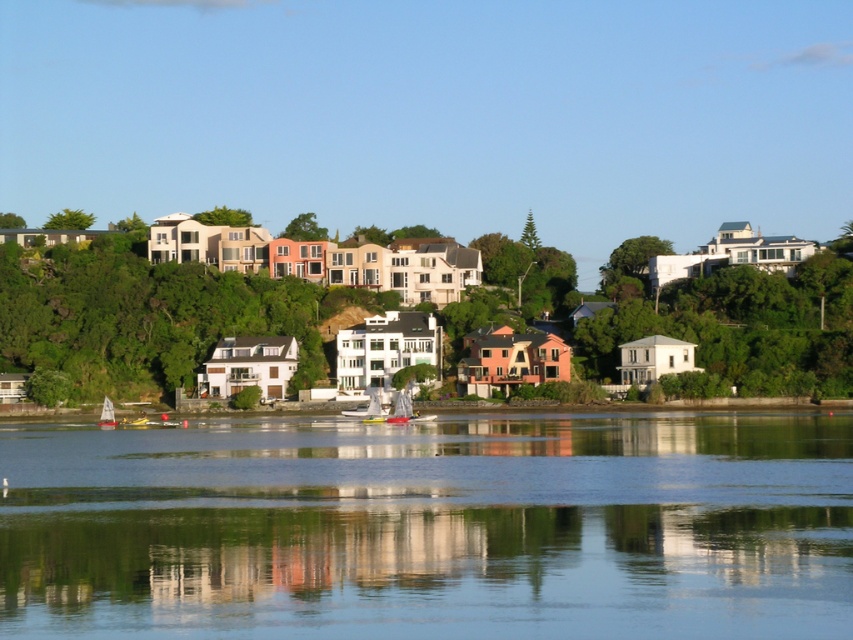
From the picture: Who is higher up, clear water at center or smooth concrete shoreline at lower center?

Positioned higher is smooth concrete shoreline at lower center.

Which is more to the right, clear water at center or smooth concrete shoreline at lower center?

clear water at center is more to the right.

Where is `clear water at center`? The height and width of the screenshot is (640, 853). clear water at center is located at coordinates (431, 528).

Is smooth concrete shoreline at lower center positioned in front of yellow matte sailboat at lower left?

No, smooth concrete shoreline at lower center is behind yellow matte sailboat at lower left.

Describe the element at coordinates (749, 403) in the screenshot. I see `smooth concrete shoreline at lower center` at that location.

Identify the location of smooth concrete shoreline at lower center. (749, 403).

Who is shorter, clear water at center or yellow matte sailboat at lower left?

With less height is clear water at center.

In the scene shown: Which of these two, clear water at center or yellow matte sailboat at lower left, stands taller?

yellow matte sailboat at lower left is taller.

Does point (608, 429) come farther from viewer compared to point (106, 412)?

No, (608, 429) is in front of (106, 412).

Locate an element on the screen. The height and width of the screenshot is (640, 853). clear water at center is located at coordinates [431, 528].